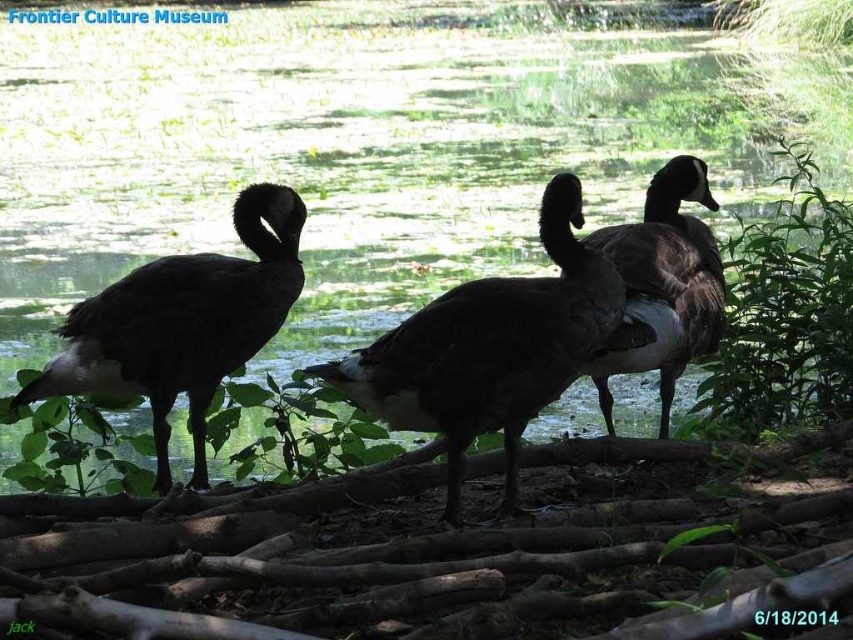
You are a wildlife photographer observing the scene at the Frontier Culture Museum. You notice a dark glossy goose at center and dark brown feathers at center. Which object is positioned more to the right?

The dark brown feathers at center are positioned more to the right than the dark glossy goose at center.

Consider the image. What is the 2D coordinate of the dark brown feathers at left?

The dark brown feathers at left are located at the 2D coordinate point of (183, 323).

You are standing at the point labeled point [556,349] and want to walk towards the point labeled point [136,324]. Given that you can only move along the ground visible in the scene, will you have to go uphill or downhill?

Since point [556,349] is closer to the viewer than point [136,324], this suggests that the ground slopes downward from the starting point to the destination. Therefore, you would have to walk downhill towards the point labeled point [136,324].